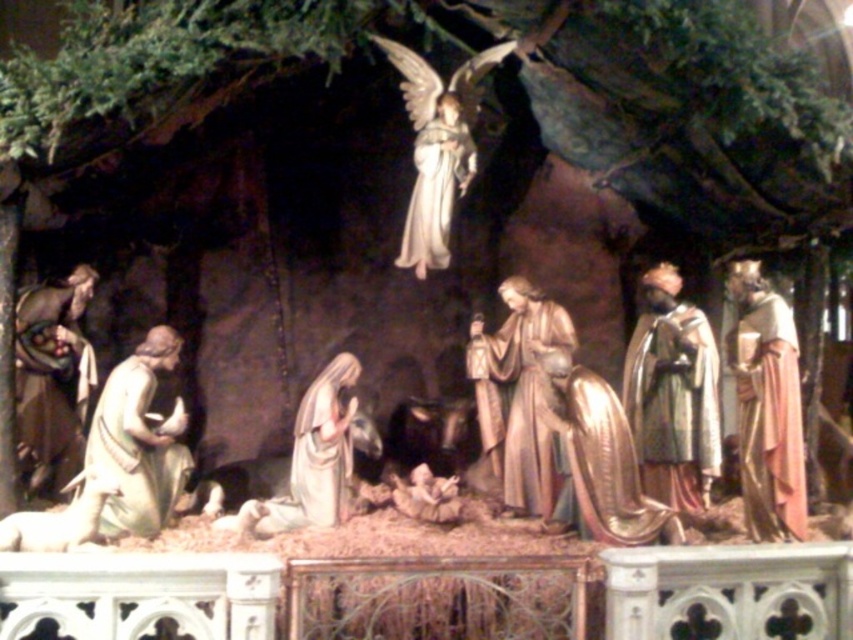
Question: Based on their relative distances, which object is farther from the gold metallic angel at center?

Choices:
 (A) gold metallic robe at right
 (B) gold metallic robe at center
 (C) matte gold statue at center
 (D) matte gold robe at lower left

Answer: (D)

Question: Considering the real-world distances, which object is closest to the matte gold robe at lower left?

Choices:
 (A) gold textured robe at right
 (B) matte beige statue at lower left
 (C) gold metallic robe at right
 (D) gold metallic robe at center

Answer: (B)

Question: Is matte gold statue at center further to the viewer compared to white marble lamb at lower left?

Choices:
 (A) no
 (B) yes

Answer: (B)

Question: Based on their relative distances, which object is farther from the gold metallic robe at center?

Choices:
 (A) gold metallic angel at center
 (B) matte gold robe at lower left
 (C) white marble lamb at lower left

Answer: (C)

Question: Can you confirm if gold textured robe at right is positioned to the right of gold metallic angel at center?

Choices:
 (A) yes
 (B) no

Answer: (A)

Question: Can you confirm if gold metallic robe at center is smaller than gold metallic angel at upper center?

Choices:
 (A) no
 (B) yes

Answer: (A)